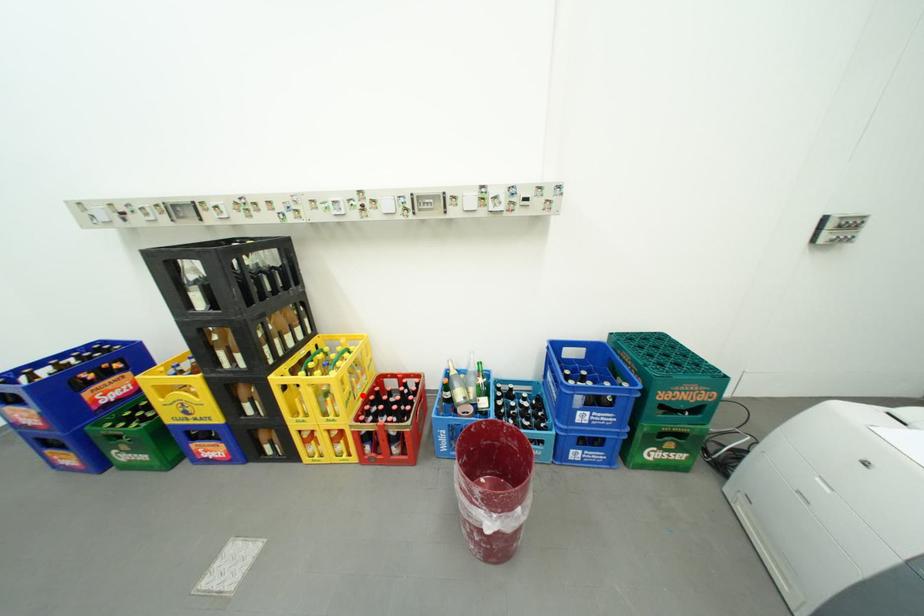
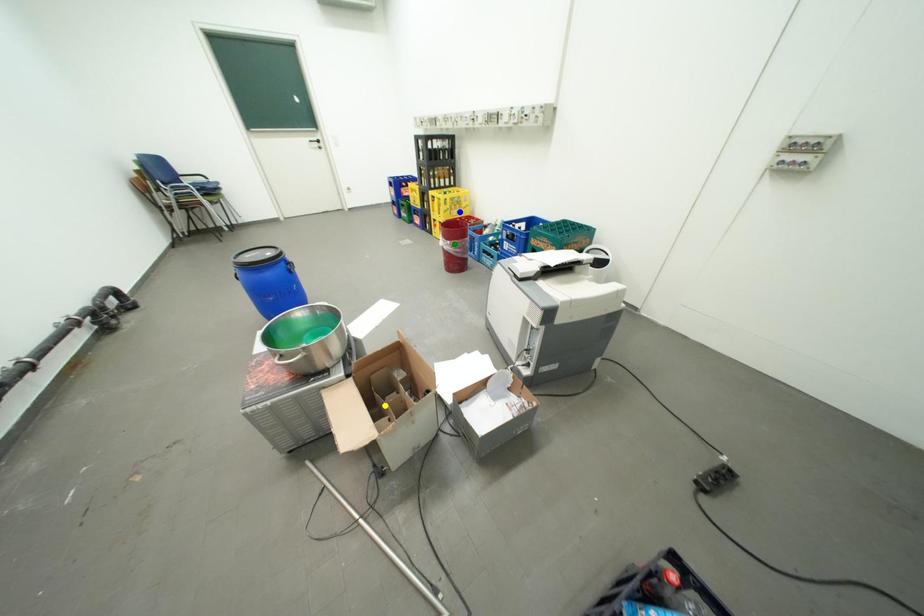
Question: I am providing you with two images of the same scene from different viewpoints. A red point is marked on the first image. You are given multiple points on the second image. Which mark in image 2 goes with the point in image 1?

Choices:
 (A) blue point
 (B) green point
 (C) yellow point

Answer: (A)